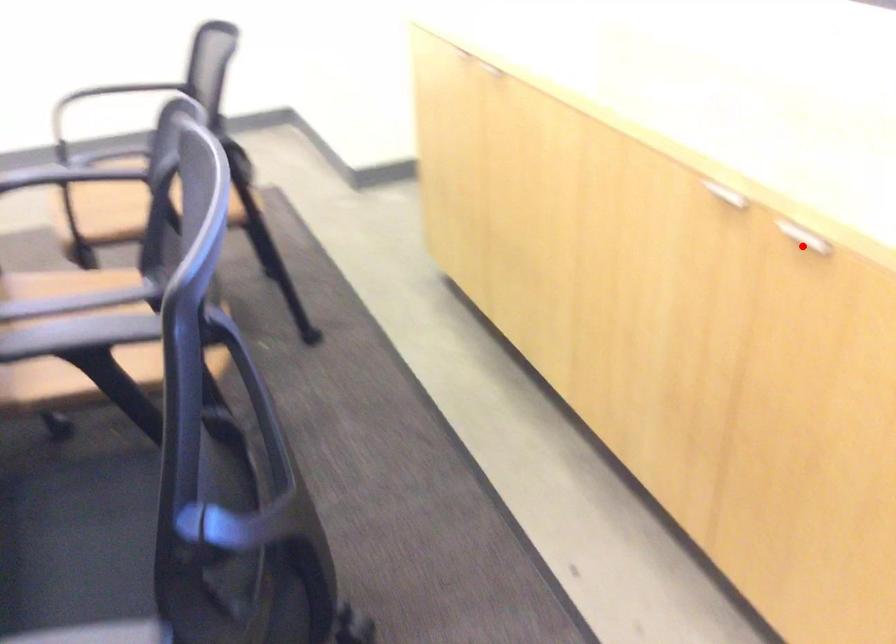
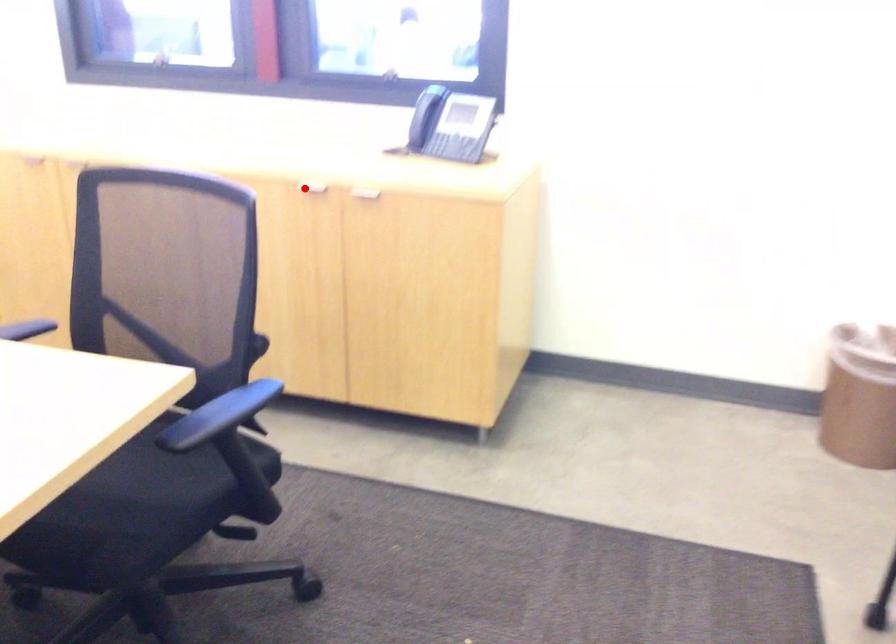
I am providing you with two images of the same scene from different viewpoints. A red point is marked on the first image and another point is marked on the second image. Does the point marked in image1 correspond to the same location as the one in image2?

No